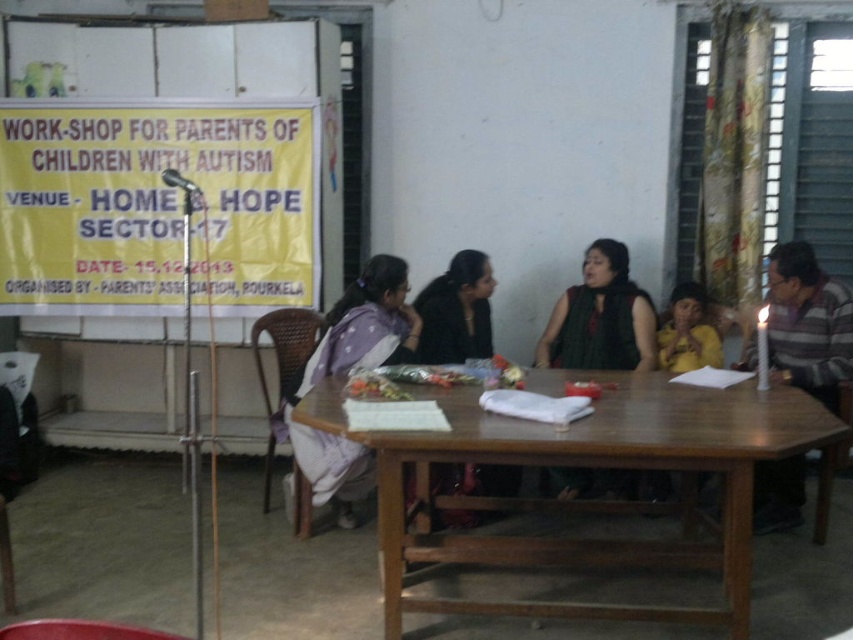
You are a photographer at the event and want to take a photo of the green matte scarf at center and the black matte jacket at center. Which object is positioned more to the right side of the frame?

The green matte scarf at center is positioned more to the right side of the frame compared to the black matte jacket at center.

There is a brown wooden table at center and a banner on the wall in the background. How far apart are these two objects?

The brown wooden table at center and the banner on the wall in the background are 2.53 meters apart.

You are attending the workshop and need to place a small note on the purple fabric at center. Where should you place it in relation to the green matte scarf at center?

The purple fabric at center is located below the green matte scarf at center, so you should place the note below the green matte scarf at center.